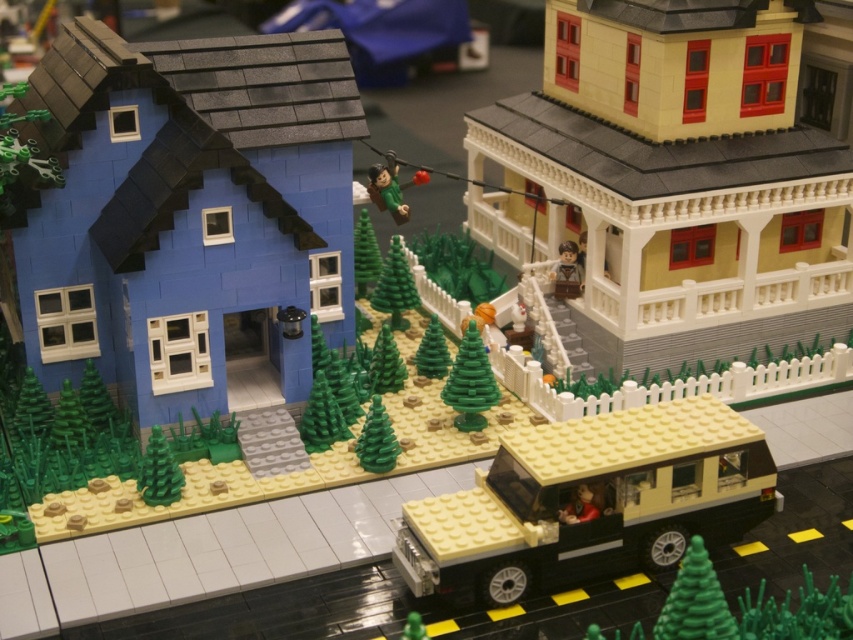
Is matte yellow plastic car at center to the left of green matte tree at center from the viewer's perspective?

Incorrect, matte yellow plastic car at center is not on the left side of green matte tree at center.

Can you confirm if matte yellow plastic car at center is positioned to the right of green matte tree at center?

Indeed, matte yellow plastic car at center is positioned on the right side of green matte tree at center.

You are a GUI agent. You are given a task and a screenshot of the screen. Output one action in this format:
    pyautogui.click(x=<x>, y=<y>)
    Task: Click on the matte yellow plastic car at center
    
    Given the screenshot: What is the action you would take?
    pyautogui.click(x=590, y=500)

Can you confirm if smooth black roof at upper center is positioned above green matte figure at center?

Yes.

Which is more to the left, smooth black roof at upper center or green matte figure at center?

From the viewer's perspective, smooth black roof at upper center appears more on the left side.

Between point (281, 12) and point (405, 214), which one is positioned in front?

Point (405, 214) is in front.

This screenshot has height=640, width=853. What are the coordinates of `smooth black roof at upper center` in the screenshot? It's located at (381, 32).

Is matte yellow plastic car at center above smooth black roof at upper center?

No, matte yellow plastic car at center is not above smooth black roof at upper center.

Is matte yellow plastic car at center wider than smooth black roof at upper center?

In fact, matte yellow plastic car at center might be narrower than smooth black roof at upper center.

Does point (556, 481) come closer to viewer compared to point (445, 8)?

That is True.

This screenshot has width=853, height=640. I want to click on matte yellow plastic car at center, so click(x=590, y=500).